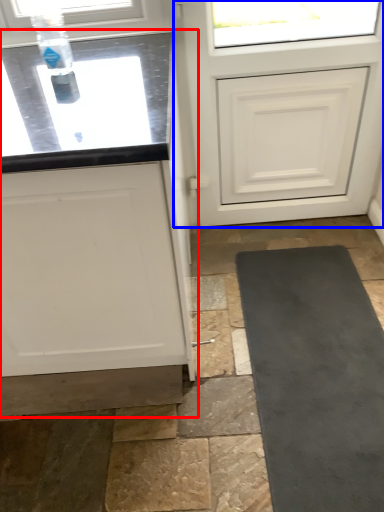
Question: Which of the following is the farthest to the observer, cabinetry (highlighted by a red box) or door (highlighted by a blue box)?

Choices:
 (A) cabinetry
 (B) door

Answer: (B)